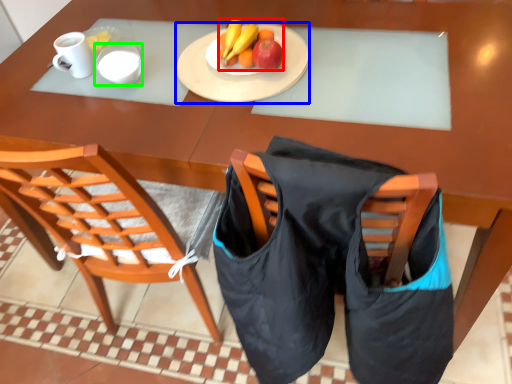
Question: Estimate the real-world distances between objects in this image. Which object is farther from banana (highlighted by a red box), plate (highlighted by a blue box) or mug (highlighted by a green box)?

Choices:
 (A) plate
 (B) mug

Answer: (B)